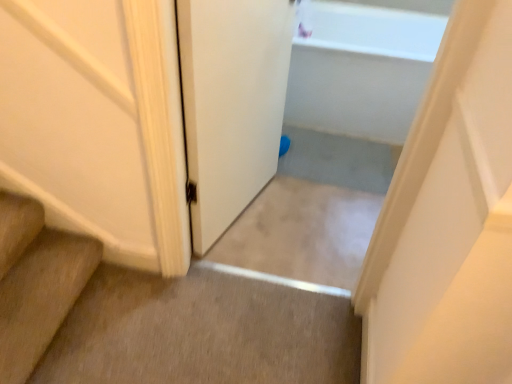
Describe the element at coordinates (36, 283) in the screenshot. I see `wooden stairs at lower left` at that location.

This screenshot has width=512, height=384. I want to click on wooden stairs at lower left, so click(x=36, y=283).

At what (x,y) coordinates should I click in order to perform the action: click on wooden stairs at lower left. Please return your answer as a coordinate pair (x, y). The image size is (512, 384). Looking at the image, I should click on (36, 283).